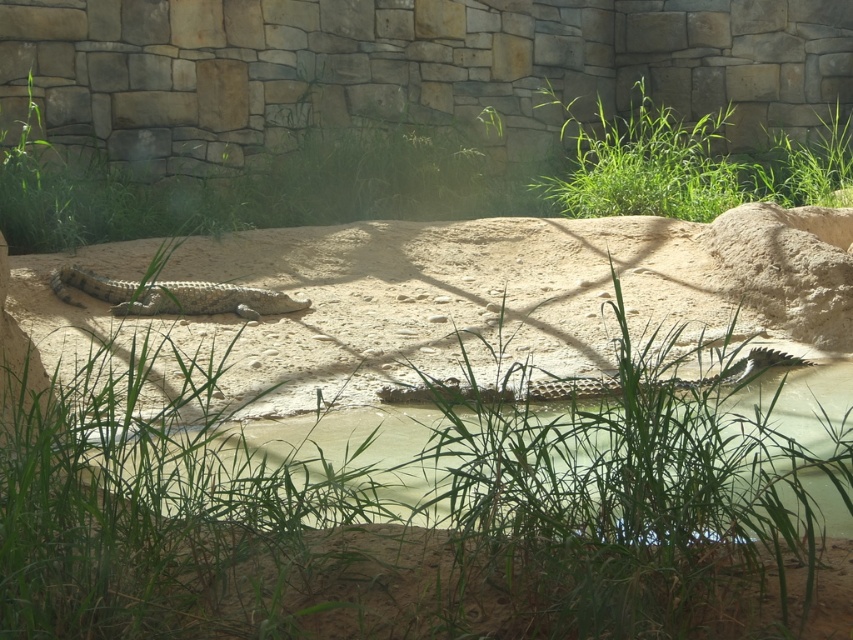
Measure the distance from leathery brown crocodile at center to leathery greenish-brown crocodile at center.

A distance of 1.96 meters exists between leathery brown crocodile at center and leathery greenish-brown crocodile at center.

Does leathery brown crocodile at center have a larger size compared to leathery greenish-brown crocodile at center?

Yes, leathery brown crocodile at center is bigger than leathery greenish-brown crocodile at center.

Locate an element on the screen. leathery brown crocodile at center is located at coordinates (173, 296).